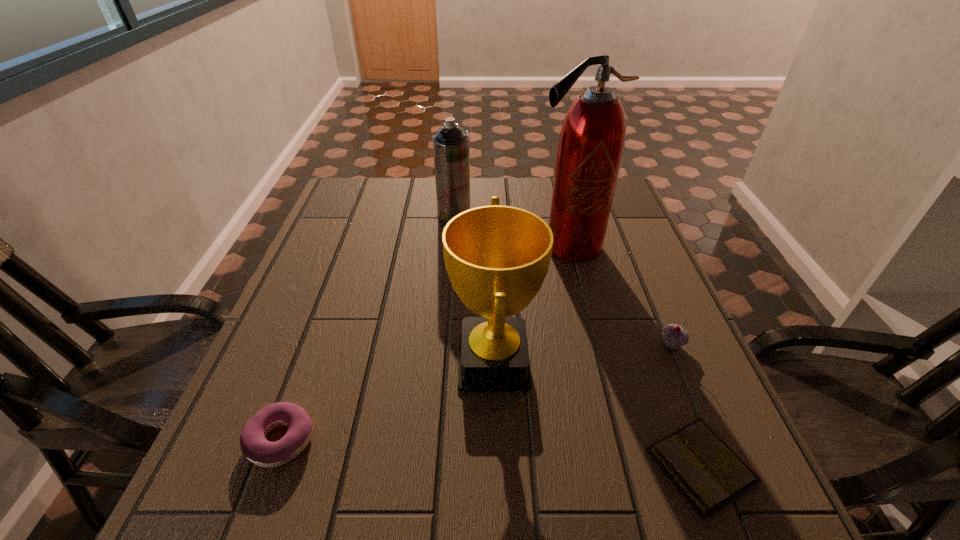
The image size is (960, 540). Find the location of `the fifth nearest object`. the fifth nearest object is located at coordinates (592, 138).

The width and height of the screenshot is (960, 540). What are the coordinates of `fire extinguisher` in the screenshot? It's located at (592, 138).

At what (x,y) coordinates should I click in order to perform the action: click on award. Please return your answer as a coordinate pair (x, y). Looking at the image, I should click on (497, 257).

The width and height of the screenshot is (960, 540). What are the coordinates of `the farthest object` in the screenshot? It's located at pos(451,152).

The height and width of the screenshot is (540, 960). What are the coordinates of `cupcake` in the screenshot? It's located at (674, 336).

Locate an element on the screen. The width and height of the screenshot is (960, 540). pastry is located at coordinates (255, 447).

Find the location of `the fifth tallest object`. the fifth tallest object is located at coordinates [255, 447].

The image size is (960, 540). I want to click on the shortest object, so click(705, 469).

The image size is (960, 540). Identify the location of vacant area located 0.290m on the back of the tallest object. click(x=553, y=181).

The height and width of the screenshot is (540, 960). What are the coordinates of `free space located on the front-facing side of the award` in the screenshot? It's located at click(x=292, y=362).